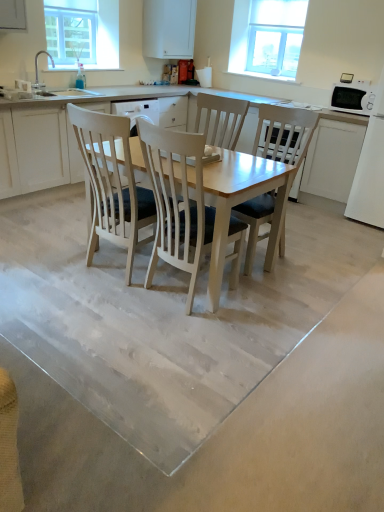
Question: Is clear glass window at upper right facing away from white glossy microwave at upper right?

Choices:
 (A) no
 (B) yes

Answer: (A)

Question: Considering the relative sizes of clear glass window at upper right and white glossy microwave at upper right in the image provided, is clear glass window at upper right smaller than white glossy microwave at upper right?

Choices:
 (A) yes
 (B) no

Answer: (B)

Question: Does clear glass window at upper right appear on the left side of white glossy microwave at upper right?

Choices:
 (A) yes
 (B) no

Answer: (A)

Question: Is clear glass window at upper right far from white glossy microwave at upper right?

Choices:
 (A) yes
 (B) no

Answer: (A)

Question: Is the depth of clear glass window at upper right less than that of white glossy microwave at upper right?

Choices:
 (A) no
 (B) yes

Answer: (A)

Question: From their relative heights in the image, would you say clear glass window screen at upper left is taller or shorter than smooth concrete floor at center?

Choices:
 (A) short
 (B) tall

Answer: (B)

Question: Is clear glass window screen at upper left bigger or smaller than smooth concrete floor at center?

Choices:
 (A) small
 (B) big

Answer: (A)

Question: Is point (59, 16) positioned closer to the camera than point (337, 452)?

Choices:
 (A) farther
 (B) closer

Answer: (A)

Question: In the image, is clear glass window screen at upper left positioned in front of or behind smooth concrete floor at center?

Choices:
 (A) behind
 (B) front

Answer: (A)

Question: From a real-world perspective, is clear glass window screen at upper left positioned above or below white glossy microwave at upper right?

Choices:
 (A) below
 (B) above

Answer: (B)

Question: From their relative heights in the image, would you say clear glass window screen at upper left is taller or shorter than white glossy microwave at upper right?

Choices:
 (A) tall
 (B) short

Answer: (A)

Question: From the image's perspective, relative to white glossy microwave at upper right, is clear glass window screen at upper left above or below?

Choices:
 (A) below
 (B) above

Answer: (B)

Question: Choose the correct answer: Is clear glass window screen at upper left inside white glossy microwave at upper right or outside it?

Choices:
 (A) inside
 (B) outside

Answer: (B)

Question: Looking at the image, does light wood chair at center, the 1th chair in the right-to-left sequence, seem bigger or smaller compared to white wood chair at center, arranged as the 2th chair when viewed from the right?

Choices:
 (A) big
 (B) small

Answer: (A)

Question: Considering their positions, is light wood chair at center, the 1th chair in the right-to-left sequence, located in front of or behind white wood chair at center, arranged as the 2th chair when viewed from the right?

Choices:
 (A) front
 (B) behind

Answer: (A)